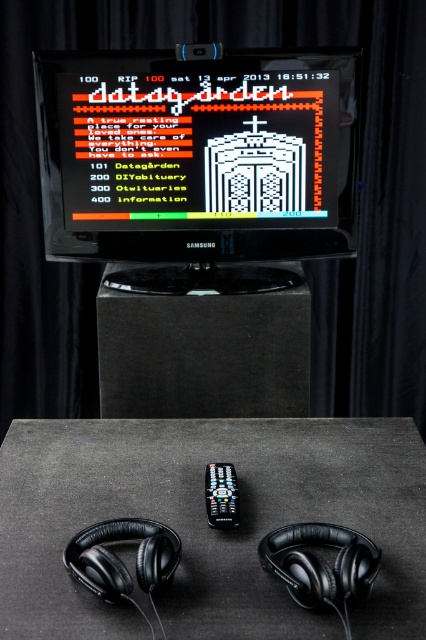
Question: Does black matte table at center have a smaller size compared to black glossy monitor at center?

Choices:
 (A) yes
 (B) no

Answer: (B)

Question: Estimate the real-world distances between objects in this image. Which object is closer to the black glossy monitor at center?

Choices:
 (A) black plastic remote at center
 (B) black matte table at center

Answer: (B)

Question: Among these points, which one is farthest from the camera?

Choices:
 (A) (400, 598)
 (B) (351, 563)

Answer: (A)

Question: Which object appears farthest from the camera in this image?

Choices:
 (A) black matte headphones at lower center
 (B) black matte table at center
 (C) black glossy monitor at center
 (D) black plastic remote at center

Answer: (C)

Question: From the image, what is the correct spatial relationship of black glossy monitor at center in relation to black plastic remote at center?

Choices:
 (A) above
 (B) below

Answer: (A)

Question: Is black matte headphones at lower center to the left of black plastic remote at center from the viewer's perspective?

Choices:
 (A) yes
 (B) no

Answer: (B)